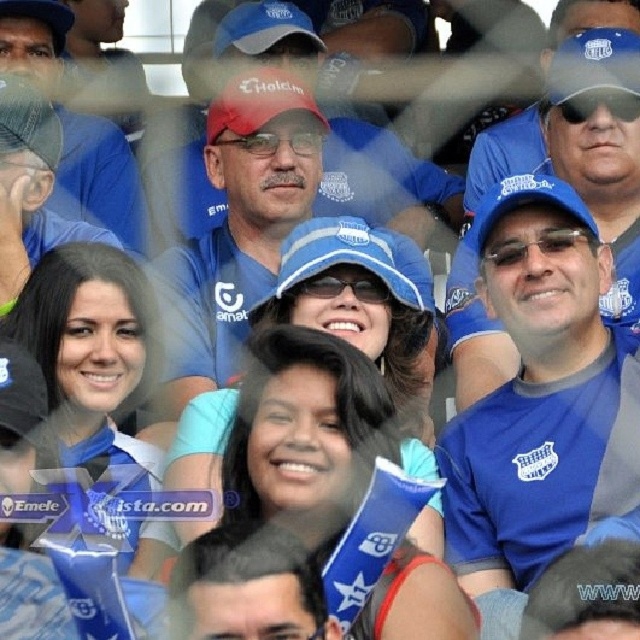
Is blue fabric shirt at center to the left of blue fabric cap at upper center from the viewer's perspective?

Yes, blue fabric shirt at center is to the left of blue fabric cap at upper center.

Is point (595, 376) closer to viewer compared to point (588, 93)?

Yes, it is.

Does point (554, 230) come behind point (612, 147)?

No, it is in front of (612, 147).

What are the coordinates of `blue fabric shirt at center` in the screenshot? It's located at (541, 404).

Locate an element on the screen. The width and height of the screenshot is (640, 640). blue fabric cap at upper center is located at coordinates (602, 176).

Can you confirm if blue fabric cap at upper center is positioned to the right of matte blue cap at upper center?

Yes, blue fabric cap at upper center is to the right of matte blue cap at upper center.

This screenshot has height=640, width=640. What do you see at coordinates (602, 176) in the screenshot?
I see `blue fabric cap at upper center` at bounding box center [602, 176].

Image resolution: width=640 pixels, height=640 pixels. I want to click on blue fabric cap at upper center, so click(x=602, y=176).

Who is more forward, (520,454) or (60,113)?

Point (520,454) is more forward.

Is the position of blue fabric shirt at center less distant than that of matte blue cap at upper center?

That is True.

Is point (541, 177) closer to viewer compared to point (52, 189)?

Yes.

The height and width of the screenshot is (640, 640). I want to click on blue fabric shirt at center, so click(541, 404).